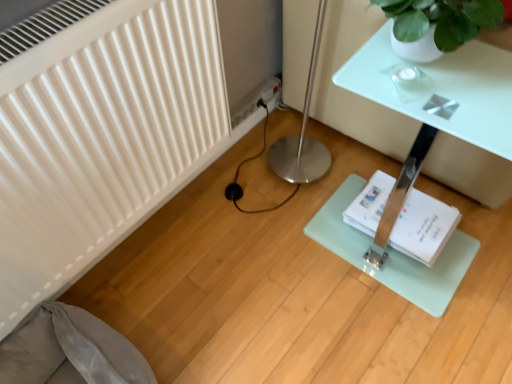
The height and width of the screenshot is (384, 512). In order to click on free space to the back side of gray fabric swivel chair at lower left in this screenshot , I will do `click(154, 283)`.